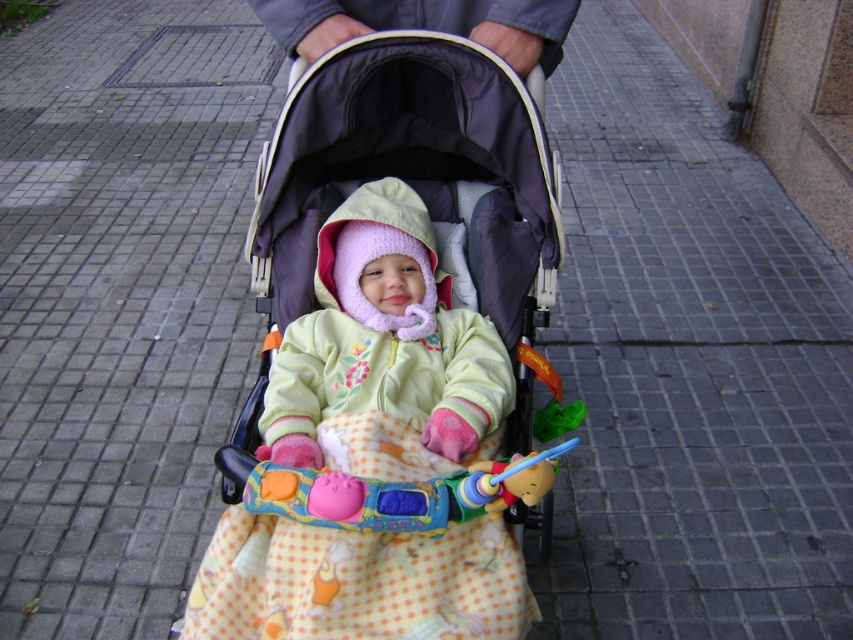
Which is more to the right, dark purple fabric baby carriage at center or plastic colorful toy at center?

From the viewer's perspective, plastic colorful toy at center appears more on the right side.

Does dark purple fabric baby carriage at center have a lesser width compared to plastic colorful toy at center?

Incorrect, dark purple fabric baby carriage at center's width is not less than plastic colorful toy at center's.

Locate an element on the screen. This screenshot has height=640, width=853. dark purple fabric baby carriage at center is located at coordinates (415, 192).

Who is lower down, light green fleece jacket at center or plastic colorful toy at center?

Positioned lower is plastic colorful toy at center.

Is light green fleece jacket at center behind plastic colorful toy at center?

Yes, light green fleece jacket at center is behind plastic colorful toy at center.

Does point (390, 301) come farther from viewer compared to point (335, 476)?

Yes, it is.

Locate an element on the screen. This screenshot has height=640, width=853. light green fleece jacket at center is located at coordinates (384, 337).

Can you confirm if dark purple fabric baby carriage at center is thinner than light green fleece jacket at center?

In fact, dark purple fabric baby carriage at center might be wider than light green fleece jacket at center.

Does dark purple fabric baby carriage at center appear over light green fleece jacket at center?

No, dark purple fabric baby carriage at center is not above light green fleece jacket at center.

Measure the distance between point (378, 36) and camera.

Point (378, 36) is 5.17 feet from camera.

At what (x,y) coordinates should I click in order to perform the action: click on dark purple fabric baby carriage at center. Please return your answer as a coordinate pair (x, y). The height and width of the screenshot is (640, 853). Looking at the image, I should click on (415, 192).